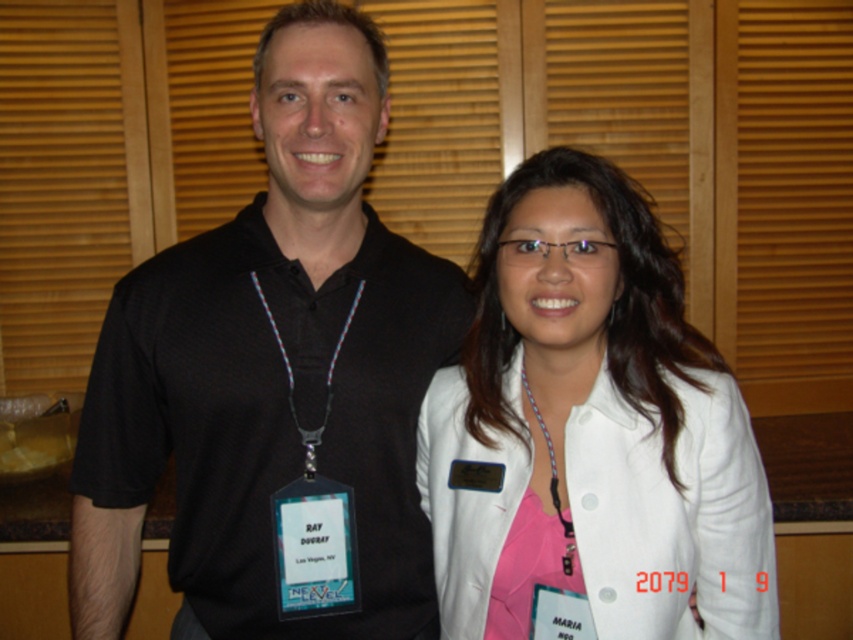
Question: Is white matte jacket at center in front of purple beaded necklace at center?

Choices:
 (A) no
 (B) yes

Answer: (B)

Question: Is black mesh shirt at center smaller than white matte jacket at center?

Choices:
 (A) yes
 (B) no

Answer: (B)

Question: Does black mesh shirt at center come behind white matte jacket at center?

Choices:
 (A) yes
 (B) no

Answer: (A)

Question: Among these points, which one is farthest from the camera?

Choices:
 (A) (526, 397)
 (B) (579, 582)

Answer: (A)

Question: Which object is farther from the camera taking this photo?

Choices:
 (A) purple beaded necklace at center
 (B) white matte jacket at center
 (C) black mesh shirt at center

Answer: (C)

Question: Which of these objects is positioned farthest from the white matte jacket at center?

Choices:
 (A) purple beaded necklace at center
 (B) black mesh shirt at center

Answer: (B)